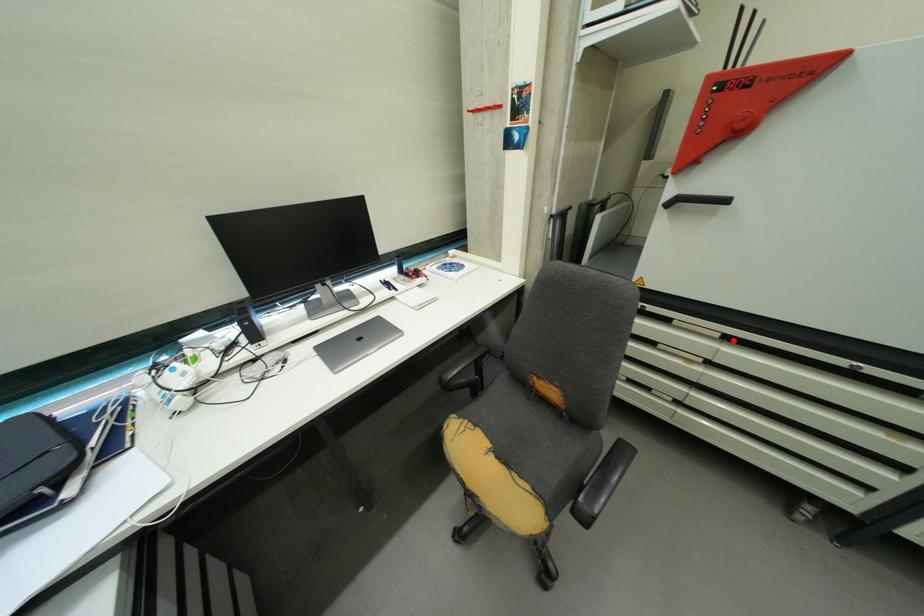
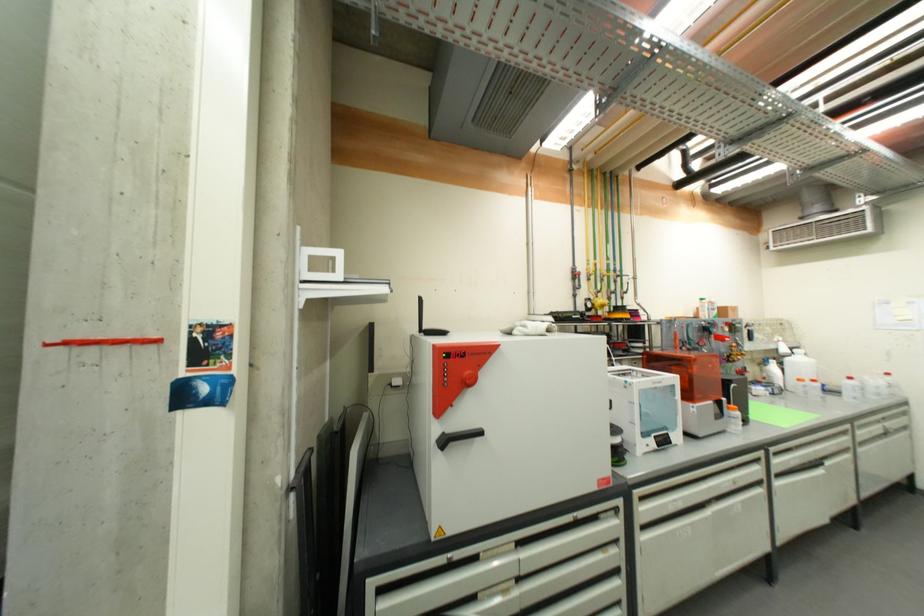
Where in the second image is the point corresponding to the highlighted location from the first image?

(525, 546)